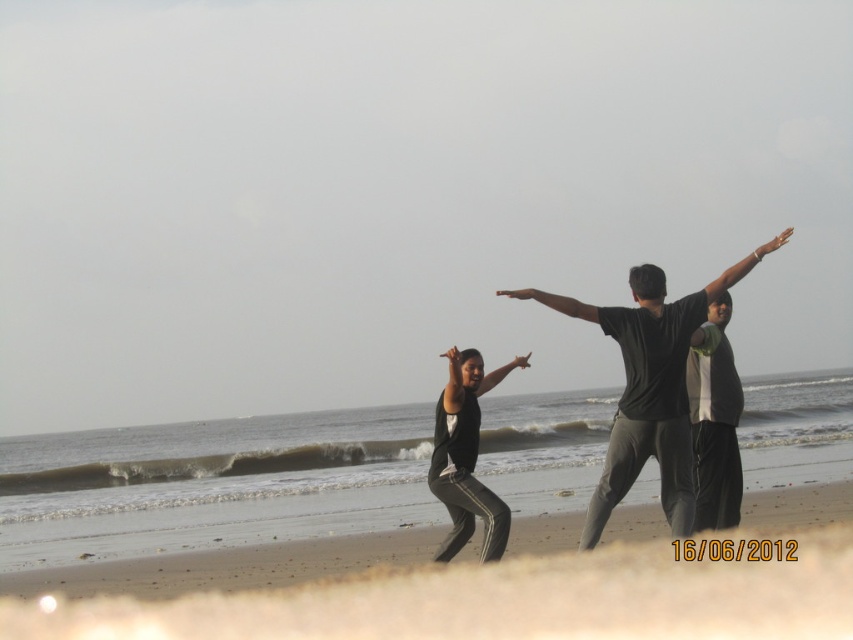
In the scene shown: Between dark gray cotton shirt at right and black matte arm at center, which one is positioned higher?

dark gray cotton shirt at right

Can you confirm if dark gray cotton shirt at right is positioned to the right of black matte arm at center?

Yes, dark gray cotton shirt at right is to the right of black matte arm at center.

Locate an element on the screen. dark gray cotton shirt at right is located at coordinates (714, 420).

Is beige sandy beach at lower center closer to camera compared to black matte pants at center?

Yes, beige sandy beach at lower center is closer to the viewer.

Is point (158, 573) farther from camera compared to point (457, 444)?

Yes, point (158, 573) is behind point (457, 444).

Where is `beige sandy beach at lower center`? beige sandy beach at lower center is located at coordinates (468, 584).

Can you confirm if black matte arm at upper right is smaller than black matte arm at center?

Incorrect, black matte arm at upper right is not smaller in size than black matte arm at center.

Does black matte arm at upper right have a lesser height compared to black matte arm at center?

No, black matte arm at upper right is not shorter than black matte arm at center.

Which is in front, point (759, 250) or point (527, 364)?

Point (759, 250) is in front.

Image resolution: width=853 pixels, height=640 pixels. I want to click on black matte arm at upper right, so click(x=741, y=268).